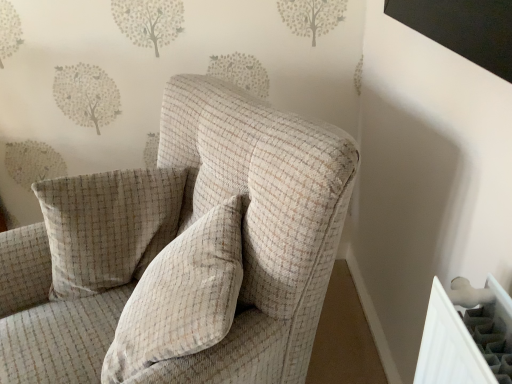
Question: In terms of height, does beige checkered pillow at center, the second pillow when ordered from back to front, look taller or shorter compared to beige checkered pillow at center, which ranks as the 1th pillow in back-to-front order?

Choices:
 (A) tall
 (B) short

Answer: (B)

Question: Relative to beige checkered pillow at center, which ranks as the 1th pillow in back-to-front order, is beige checkered pillow at center, the 1th pillow positioned from the front, in front or behind?

Choices:
 (A) front
 (B) behind

Answer: (A)

Question: Estimate the real-world distances between objects in this image. Which object is closer to the beige checkered pillow at center, the 1th pillow positioned from the front?

Choices:
 (A) beige checkered armchair at center
 (B) beige checkered pillow at center, which ranks as the 1th pillow in back-to-front order

Answer: (A)

Question: Which object is positioned closest to the beige checkered armchair at center?

Choices:
 (A) beige checkered pillow at center, which ranks as the 1th pillow in back-to-front order
 (B) beige checkered pillow at center, the 1th pillow positioned from the front

Answer: (B)